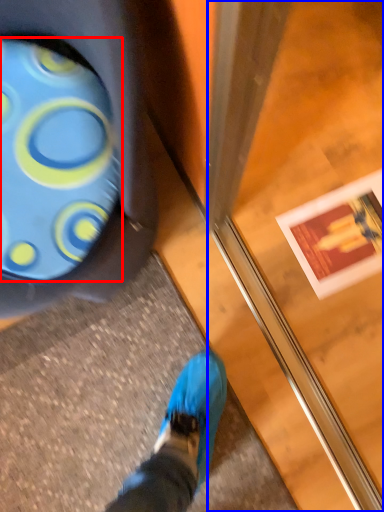
Question: Which object appears farthest to the camera in this image, footwear (highlighted by a red box) or screen door (highlighted by a blue box)?

Choices:
 (A) footwear
 (B) screen door

Answer: (A)